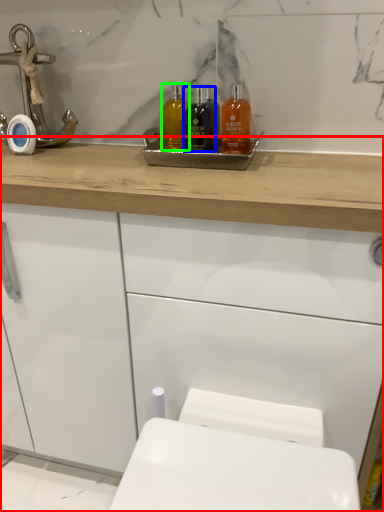
Question: Considering the real-world distances, which object is closest to bathroom cabinet (highlighted by a red box)? mouthwash (highlighted by a blue box) or mouthwash (highlighted by a green box).

Choices:
 (A) mouthwash
 (B) mouthwash

Answer: (A)